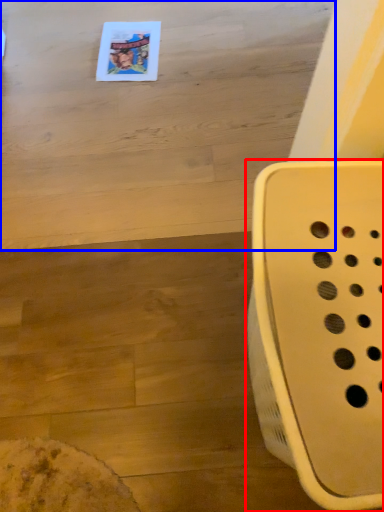
Question: Which object appears closest to the camera in this image, furniture (highlighted by a red box) or table (highlighted by a blue box)?

Choices:
 (A) furniture
 (B) table

Answer: (A)